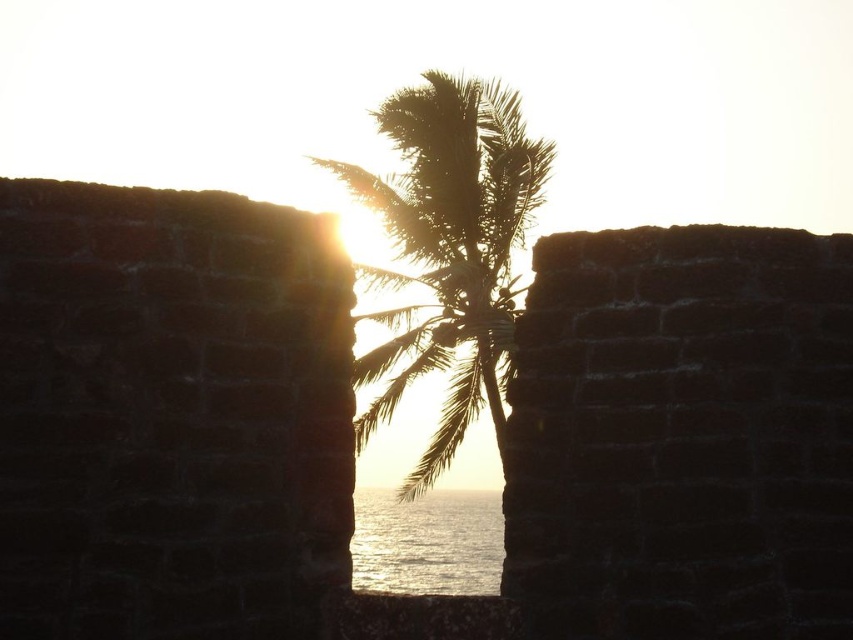
You are an architect designing a new garden pathway that must pass between the silhouette leafy palm at center and the shiny silver water at center. Based on the scene, which object should the pathway be closer to if you want to ensure it remains narrowest part of the path?

The pathway should be closer to the silhouette leafy palm at center because it is thinner than the shiny silver water at center, making the narrowest part near the palm.

You are standing in front of the stone walls and want to take a photo of the silhouette leafy palm at center and the shiny silver water at center. Which object should you focus on first to ensure both are in sharp focus?

You should focus on the silhouette leafy palm at center first because it is closer to the viewer than the shiny silver water at center. By focusing on the closer object, the background object may still be in focus depending on the depth of field.